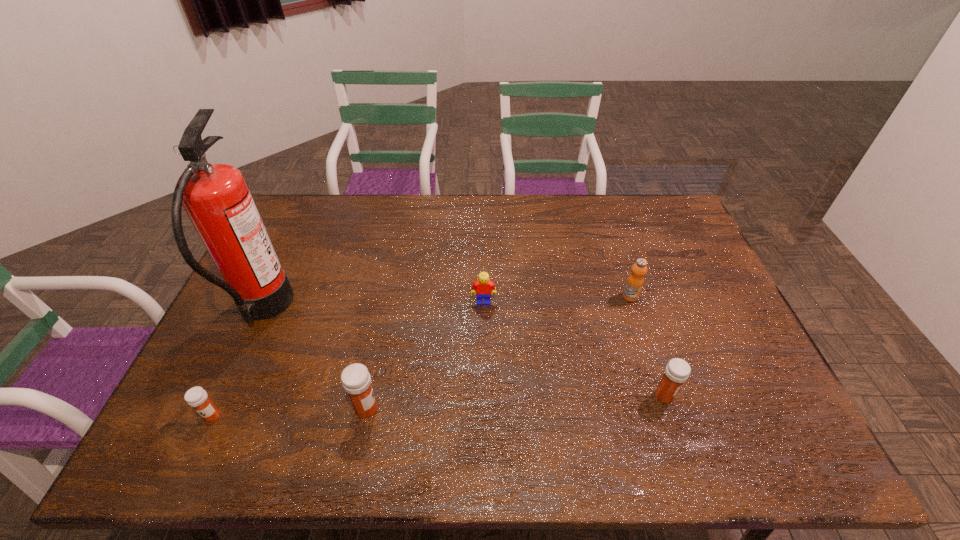
Please mark a free spot for a new medicine to balance the arrangement. Please provide its 2D coordinates. Your answer should be formatted as a tuple, i.e. [(x, y)], where the tuple contains the x and y coordinates of a point satisfying the conditions above.

[(517, 402)]